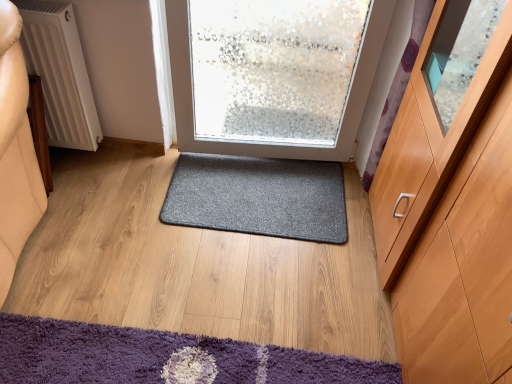
Question: Does light brown wood cabinet at right lie in front of dark gray carpet at center, the second mat when ordered from bottom to top?

Choices:
 (A) yes
 (B) no

Answer: (A)

Question: Is light brown wood cabinet at right thinner than dark gray carpet at center, which appears as the 2th mat when viewed from the front?

Choices:
 (A) yes
 (B) no

Answer: (B)

Question: Is light brown wood cabinet at right far away from dark gray carpet at center, placed as the first mat when sorted from top to bottom?

Choices:
 (A) yes
 (B) no

Answer: (B)

Question: Is dark gray carpet at center, which appears as the 2th mat when viewed from the front, completely or partially inside light brown wood cabinet at right?

Choices:
 (A) yes
 (B) no

Answer: (B)

Question: From the image's perspective, is light brown wood cabinet at right on top of dark gray carpet at center, positioned as the 1th mat in back-to-front order?

Choices:
 (A) no
 (B) yes

Answer: (A)

Question: Is point (507, 195) positioned closer to the camera than point (248, 347)?

Choices:
 (A) farther
 (B) closer

Answer: (B)

Question: From the image's perspective, is light brown wood cabinet at right above or below purple shaggy mat at lower left, the second mat viewed from the back?

Choices:
 (A) below
 (B) above

Answer: (B)

Question: Considering the relative positions of light brown wood cabinet at right and purple shaggy mat at lower left, the second mat positioned from the top, in the image provided, is light brown wood cabinet at right to the left or to the right of purple shaggy mat at lower left, the second mat positioned from the top,?

Choices:
 (A) left
 (B) right

Answer: (B)

Question: From a real-world perspective, is light brown wood cabinet at right positioned above or below purple shaggy mat at lower left, which is the 1th mat in bottom-to-top order?

Choices:
 (A) above
 (B) below

Answer: (A)

Question: Relative to dark gray carpet at center, positioned as the 1th mat in back-to-front order, is light brown wood cabinet at right in front or behind?

Choices:
 (A) behind
 (B) front

Answer: (B)

Question: Would you say light brown wood cabinet at right is to the left or to the right of dark gray carpet at center, placed as the first mat when sorted from top to bottom, in the picture?

Choices:
 (A) right
 (B) left

Answer: (A)

Question: Is point coord(483,147) closer or farther from the camera than point coord(242,196)?

Choices:
 (A) closer
 (B) farther

Answer: (A)

Question: From the image's perspective, is light brown wood cabinet at right located above or below dark gray carpet at center, which appears as the 2th mat when viewed from the front?

Choices:
 (A) above
 (B) below

Answer: (B)

Question: Is dark gray carpet at center, placed as the first mat when sorted from top to bottom, inside the boundaries of light brown wood cabinet at right, or outside?

Choices:
 (A) inside
 (B) outside

Answer: (B)

Question: From a real-world perspective, relative to light brown wood cabinet at right, is dark gray carpet at center, placed as the first mat when sorted from top to bottom, vertically above or below?

Choices:
 (A) above
 (B) below

Answer: (B)